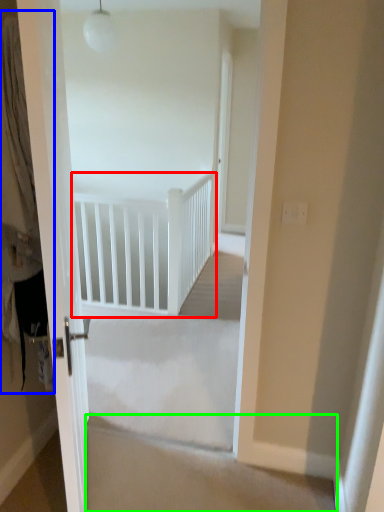
Question: Which object is the closest to the rail (highlighted by a red box)? Choose among these: curtain (highlighted by a blue box) or stairwell (highlighted by a green box).

Choices:
 (A) curtain
 (B) stairwell

Answer: (B)